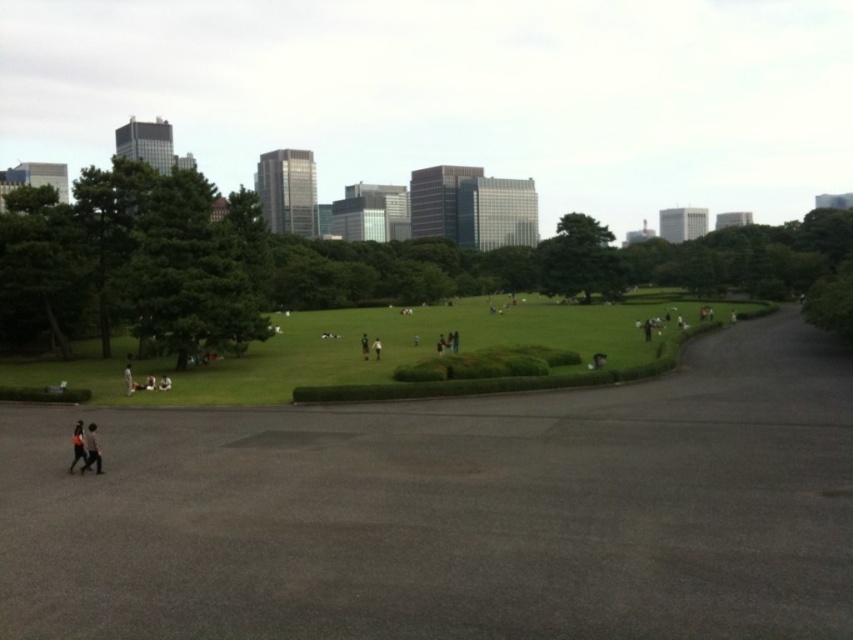
Consider the image. You are standing at the center of the park and notice a dark gray jacket at lower left. Where is the dark gray jacket located relative to your position?

The dark gray jacket at lower left is located at point 0.703 on the horizontal axis and 0.108 on the vertical axis, which places it to the lower left of your current position in the park.

You are a photographer standing at the edge of the park and want to capture both the dark gray jacket at lower left and the dark brown leather jacket at center in a single shot. Which jacket is positioned to the left of the other?

The dark gray jacket at lower left is positioned on the left side of dark brown leather jacket at center.